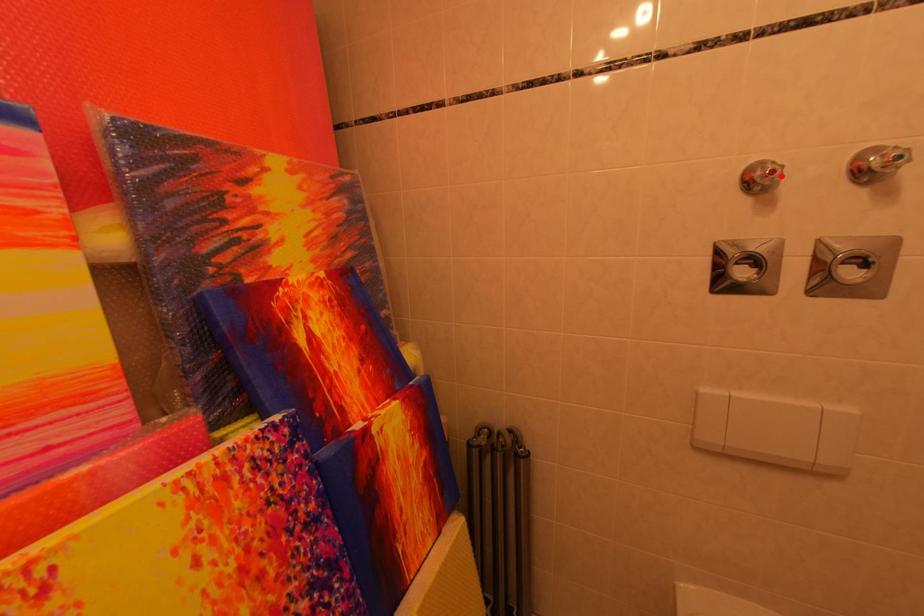
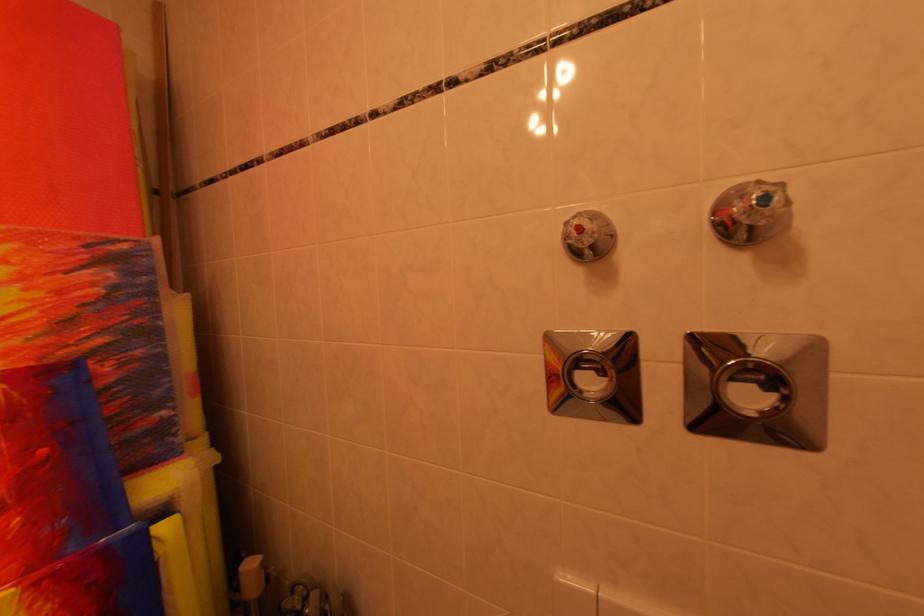
Locate, in the second image, the point that corresponds to the highlighted location in the first image.

(589, 232)